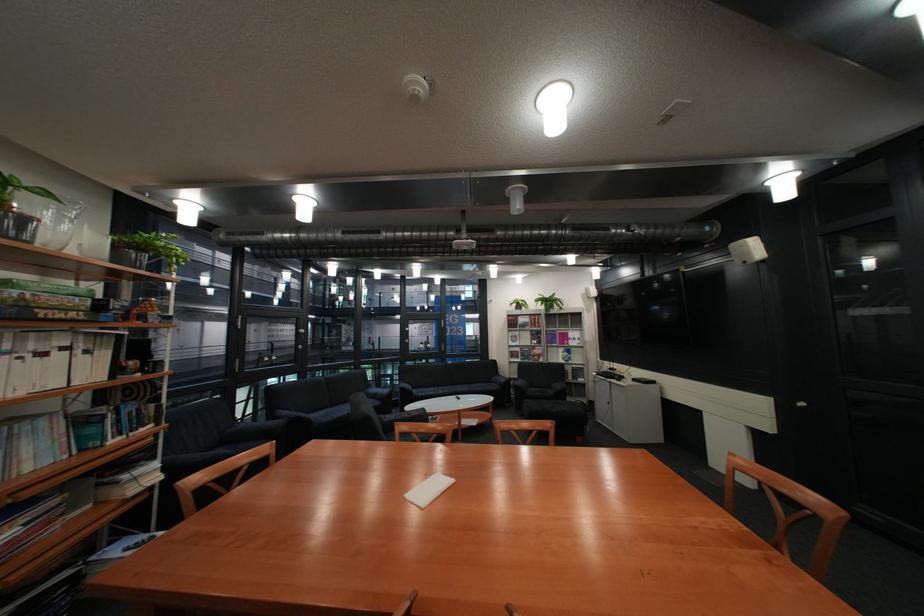
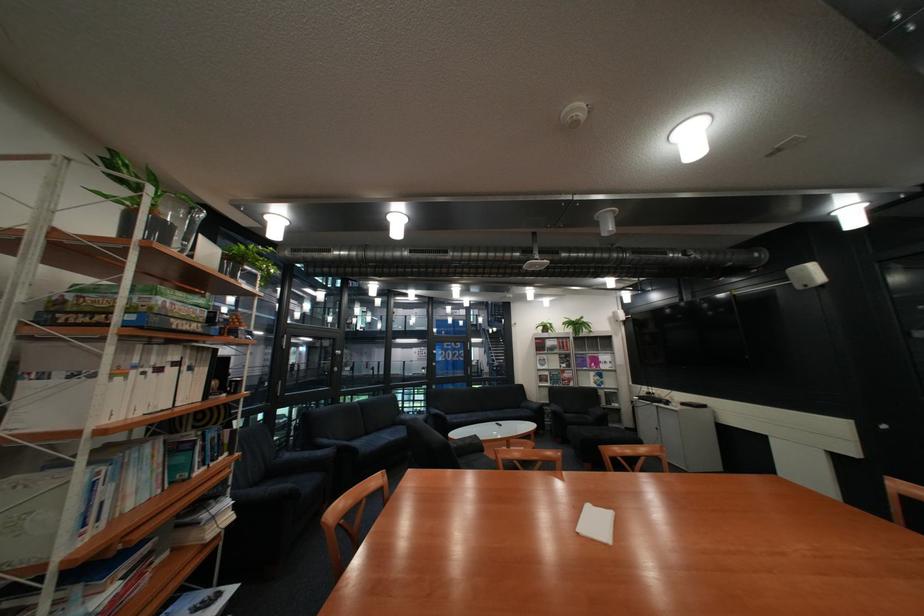
Find the pixel in the second image that matches point (58, 423) in the first image.

(163, 448)